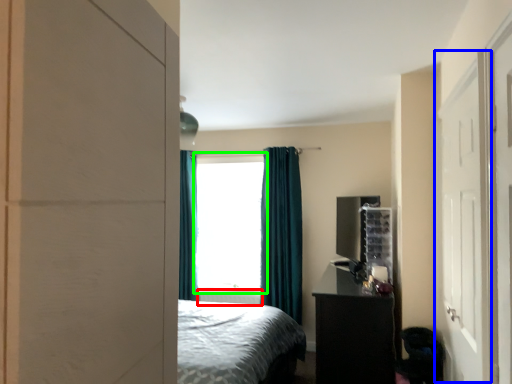
Question: Estimate the real-world distances between objects in this image. Which object is farther from radiator (highlighted by a red box), screen door (highlighted by a blue box) or window (highlighted by a green box)?

Choices:
 (A) screen door
 (B) window

Answer: (A)